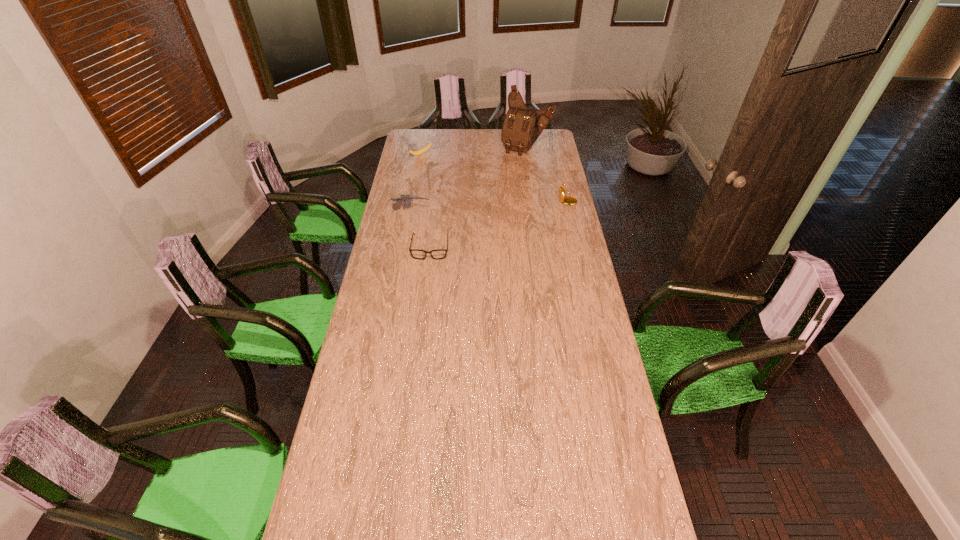
This screenshot has height=540, width=960. I want to click on the nearest object, so click(x=437, y=254).

The height and width of the screenshot is (540, 960). Find the location of `pocket watch`. pocket watch is located at coordinates (568, 200).

I want to click on gun, so click(x=407, y=199).

Identify the location of shoulder bag. (522, 126).

You are a GUI agent. You are given a task and a screenshot of the screen. Output one action in this format:
    pyautogui.click(x=<x>, y=<y>)
    Task: Click on the banana
    
    Given the screenshot: What is the action you would take?
    pyautogui.click(x=421, y=151)

The width and height of the screenshot is (960, 540). Find the location of `free location located 0.170m on the front-facing side of the spectacles`. free location located 0.170m on the front-facing side of the spectacles is located at coordinates (425, 288).

The width and height of the screenshot is (960, 540). What are the coordinates of `vacant space situated at the barrel of the fourth farthest object` in the screenshot? It's located at (477, 220).

Locate an element on the screen. The image size is (960, 540). vacant space positioned 0.260m at the barrel of the fourth farthest object is located at coordinates (482, 220).

Find the location of a particular element. vacant region located 0.280m at the barrel of the fourth farthest object is located at coordinates (486, 221).

The height and width of the screenshot is (540, 960). In order to click on free space located 0.120m on the front-facing side of the tallest object in this screenshot , I will do `click(514, 166)`.